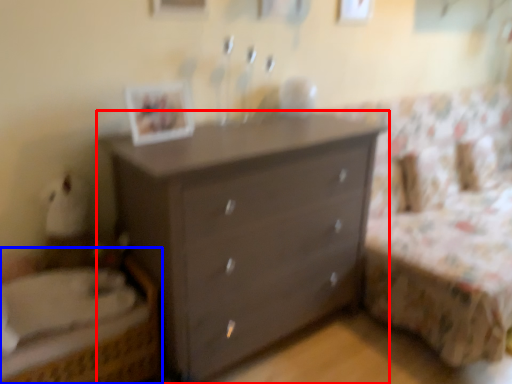
Question: Which of the following is the farthest to the observer, chest of drawers (highlighted by a red box) or bed (highlighted by a blue box)?

Choices:
 (A) chest of drawers
 (B) bed

Answer: (A)